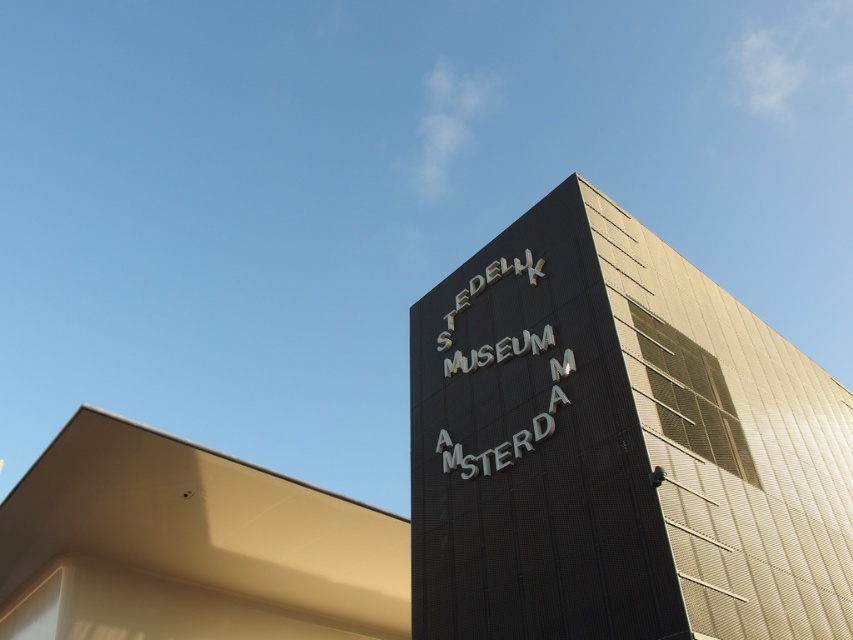
You are standing in front of the STEDelijk MUSEUM AMSTERDAM building and want to determine the relative positions of two points marked on its facade. The first point is at coordinates point (x=558, y=541) and the second is at point (x=276, y=564). Which point is closer to you?

Point (x=558, y=541) is closer to the viewer than point (x=276, y=564).

Consider the image. You are standing in front of the STEDelijk MUSEUM AMSTERDAM building. You see a point marked at coordinates (618, 445). What object is located at this point?

The point at coordinates (618, 445) marks the location of the black metallic sign at upper right.

You are a drone operator flying a drone over the modern building. You notice two objects in the image. The first is the black metallic sign at upper right and the second is the smooth beige roof at upper left. From the drone operator perspective, which object is positioned to the right side of the other?

The black metallic sign at upper right is positioned to the right of the smooth beige roof at upper left.